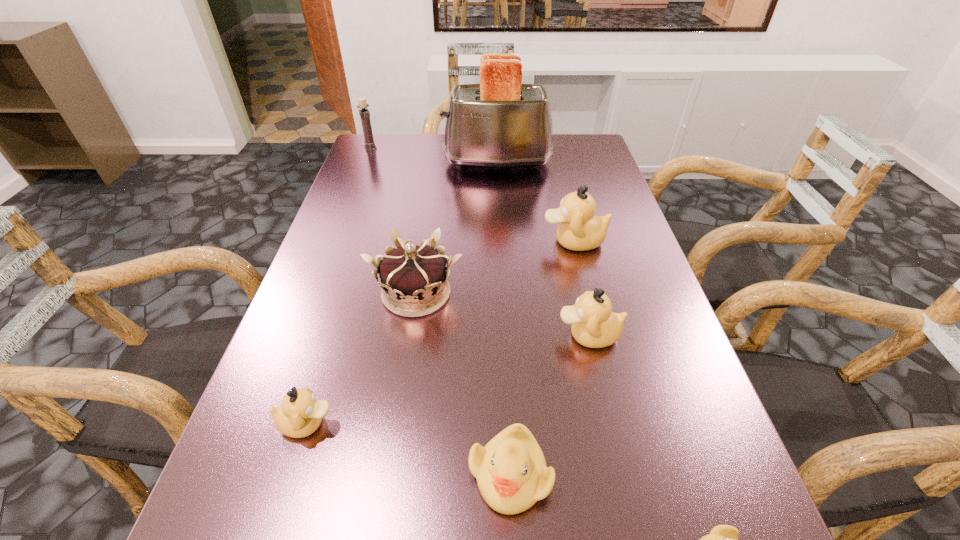
The image size is (960, 540). I want to click on object at the far left corner, so click(x=364, y=113).

Where is `object present at the far right corner`? object present at the far right corner is located at coordinates (500, 123).

The width and height of the screenshot is (960, 540). Find the location of `free space at the far edge of the desktop`. free space at the far edge of the desktop is located at coordinates (433, 145).

You are a GUI agent. You are given a task and a screenshot of the screen. Output one action in this format:
    pyautogui.click(x=<x>, y=<y>)
    Task: Click on the free space at the left edge of the desktop
    
    Given the screenshot: What is the action you would take?
    pyautogui.click(x=313, y=460)

In the image, there is a desktop. Find the location of `vacant space at the right edge`. vacant space at the right edge is located at coordinates (658, 376).

Where is `free space at the far left corner of the desktop`? The height and width of the screenshot is (540, 960). free space at the far left corner of the desktop is located at coordinates (387, 147).

Identify the location of vacant space at the far right corner of the desktop. (569, 164).

Where is `blank region between the farthest duckling and the second farthest duckling`? This screenshot has width=960, height=540. blank region between the farthest duckling and the second farthest duckling is located at coordinates (581, 288).

The image size is (960, 540). I want to click on blank region between the second farthest duckling and the leftmost object, so click(479, 241).

This screenshot has width=960, height=540. I want to click on vacant area between the fourth duckling from right to left and the candle holder, so click(441, 311).